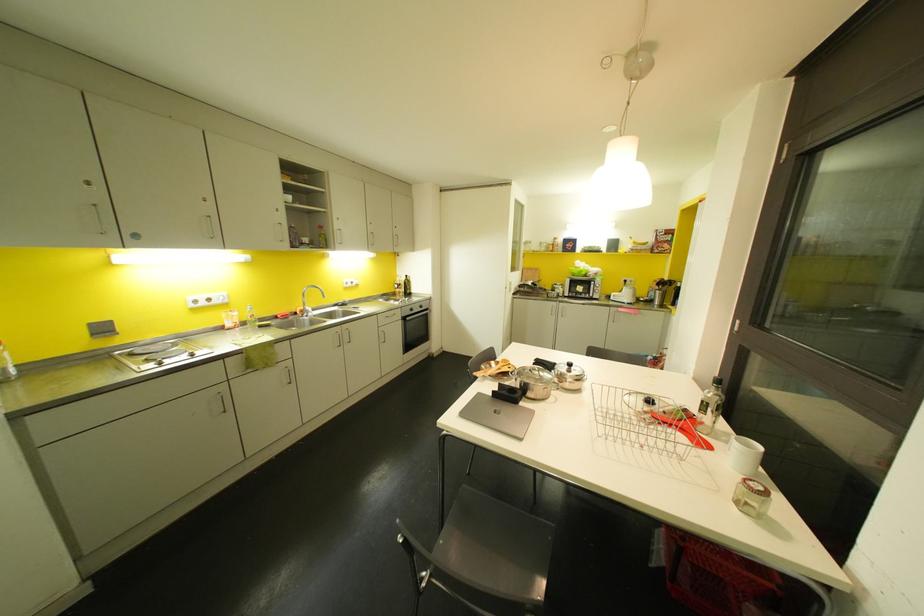
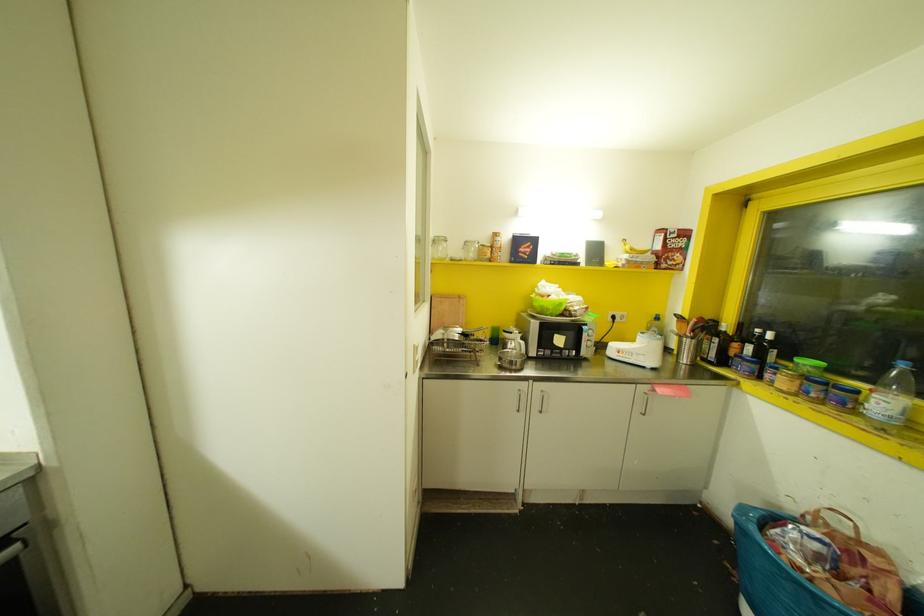
The point at (580, 270) is marked in the first image. Where is the corresponding point in the second image?

(560, 304)